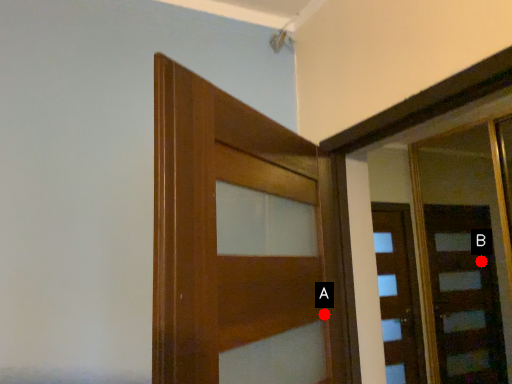
Question: Two points are circled on the image, labeled by A and B beside each circle. Which point appears farthest from the camera in this image?

Choices:
 (A) A is further
 (B) B is further

Answer: (B)